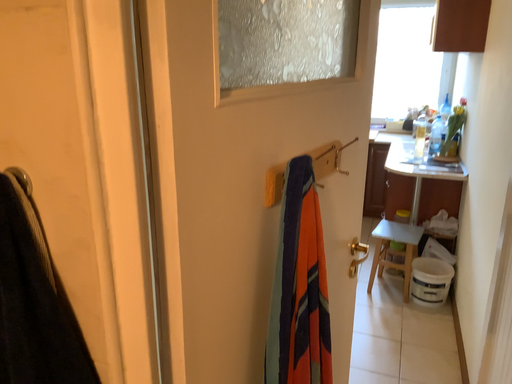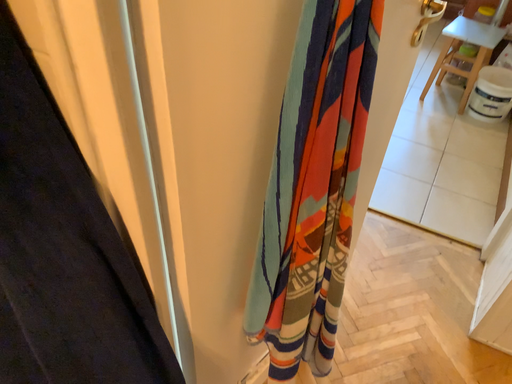
Question: How did the camera likely rotate when shooting the video?

Choices:
 (A) rotated left
 (B) rotated right

Answer: (A)